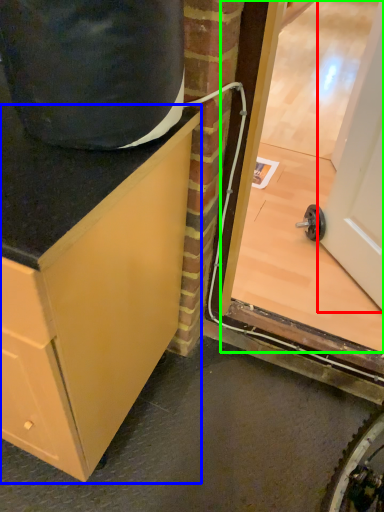
Question: Which object is the closest to the door (highlighted by a red box)? Choose among these: cabinetry (highlighted by a blue box) or glass door (highlighted by a green box).

Choices:
 (A) cabinetry
 (B) glass door

Answer: (B)